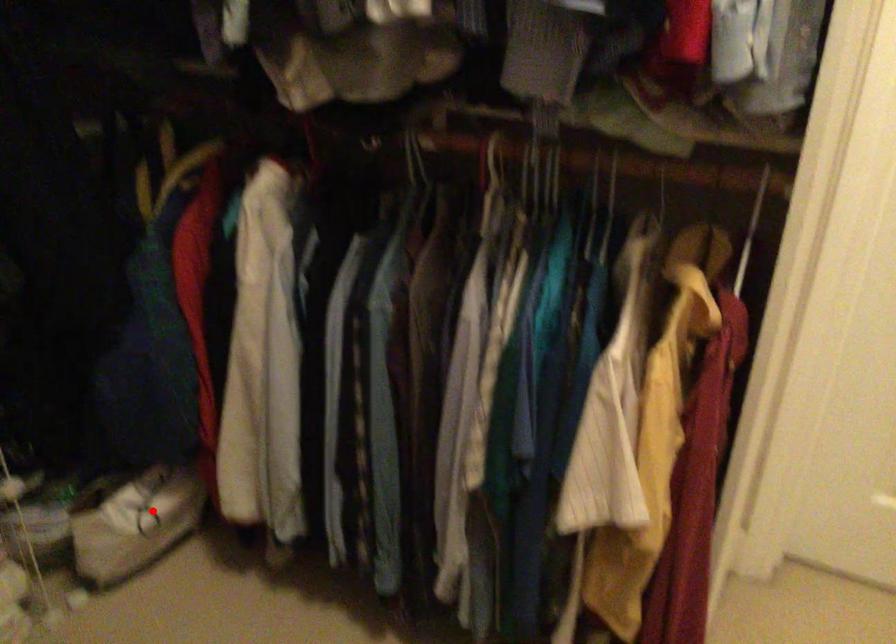
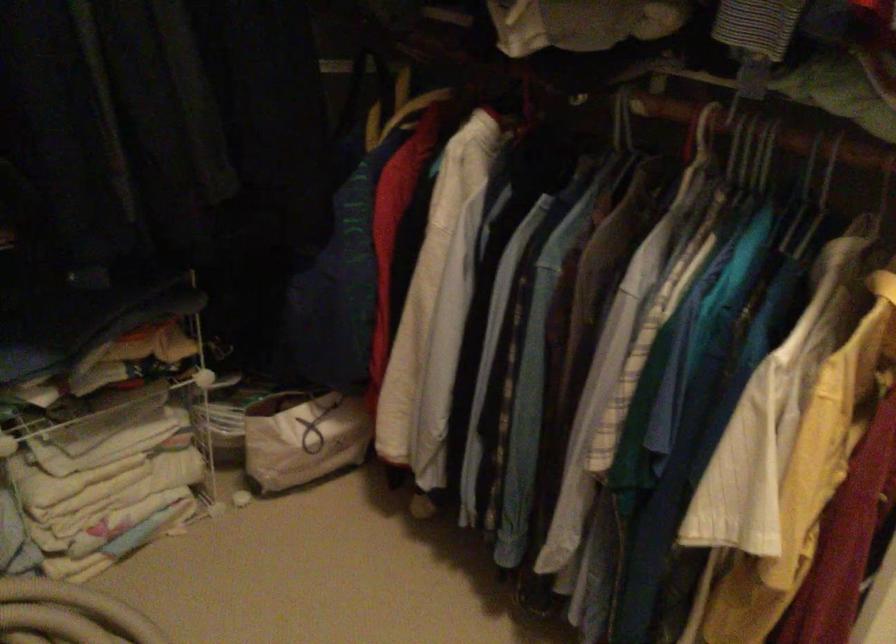
Find the pixel in the second image that matches the highlighted location in the first image.

(314, 430)